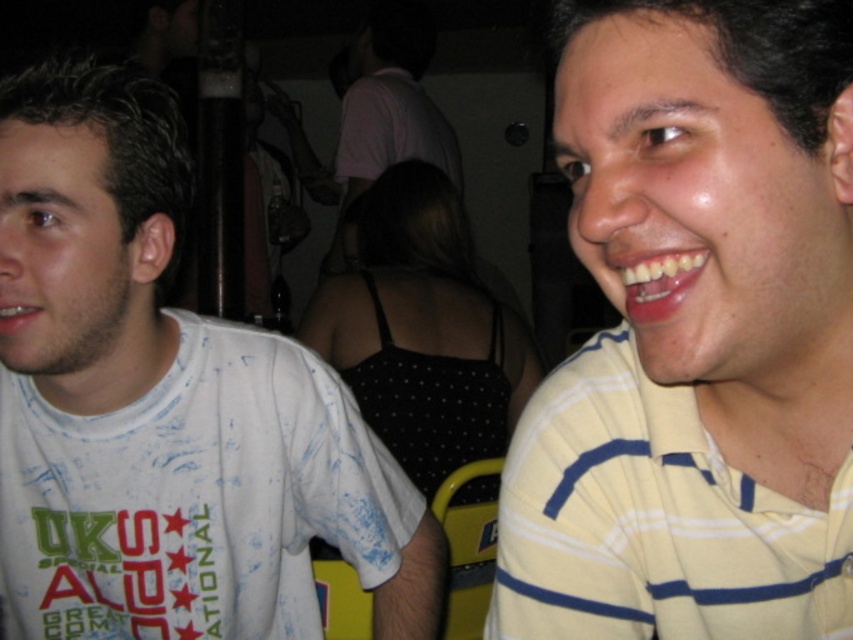
You are standing in the social setting shown in the image and want to reach the point at coordinates point (631, 282). If your reach is 16 inches, can you touch that point without moving closer?

The distance between point (631, 282) and the viewer is 16.93 inches. Since your reach is 16 inches, you cannot touch the point without moving closer.

You are taking a photo of two points in the scene. The first point is at coordinate point (x=639, y=262) and the second point is at coordinate point (x=1, y=320). Which point is closer to your camera?

Point (x=639, y=262) is closer to the camera than point (x=1, y=320).

You are a photographer at the party and want to capture a closeup of the person with the wider set of teeth. Which person should you focus on, the one with glossy white teeth at center or the white glossy teeth at lower left?

The glossy white teeth at center has a larger width than the white glossy teeth at lower left, so you should focus on the person with glossy white teeth at center.